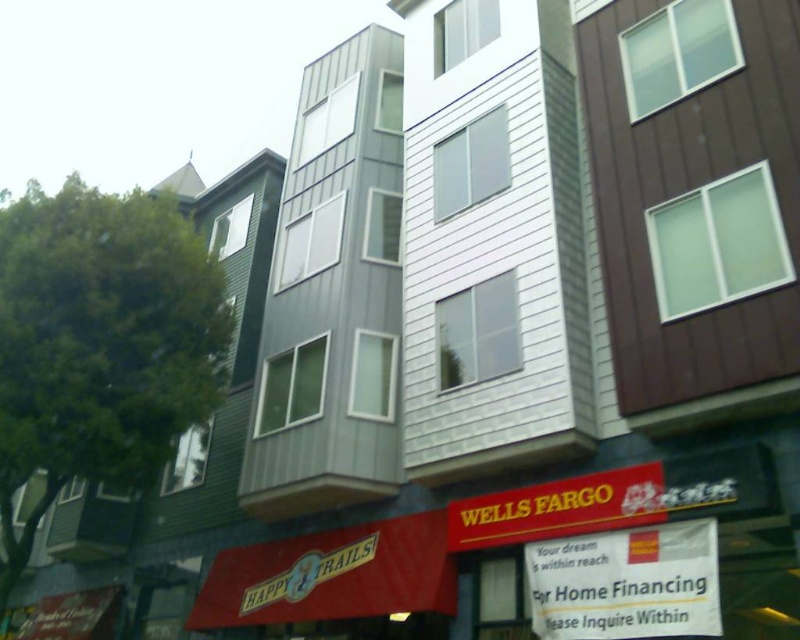
Can you confirm if white paper sign at lower center is smaller than yellow matte sign at lower center?

Correct, white paper sign at lower center occupies less space than yellow matte sign at lower center.

Between white paper sign at lower center and yellow matte sign at lower center, which one appears on the right side from the viewer's perspective?

white paper sign at lower center

Is point (686, 630) closer to viewer compared to point (596, 484)?

Yes, point (686, 630) is closer to viewer.

The image size is (800, 640). I want to click on white paper sign at lower center, so (x=626, y=582).